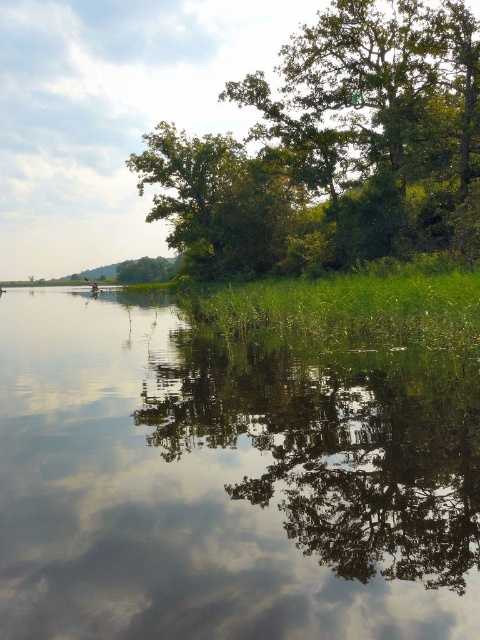
Question: Which object appears farthest from the camera in this image?

Choices:
 (A) green leafy tree at upper center
 (B) transparent water at center

Answer: (A)

Question: Is transparent water at center wider than green leafy tree at upper center?

Choices:
 (A) no
 (B) yes

Answer: (A)

Question: Does transparent water at center come in front of green leafy tree at upper center?

Choices:
 (A) no
 (B) yes

Answer: (B)

Question: Is transparent water at center smaller than green leafy tree at upper center?

Choices:
 (A) yes
 (B) no

Answer: (A)

Question: Which point is closer to the camera taking this photo?

Choices:
 (A) (182, 406)
 (B) (273, 227)

Answer: (A)